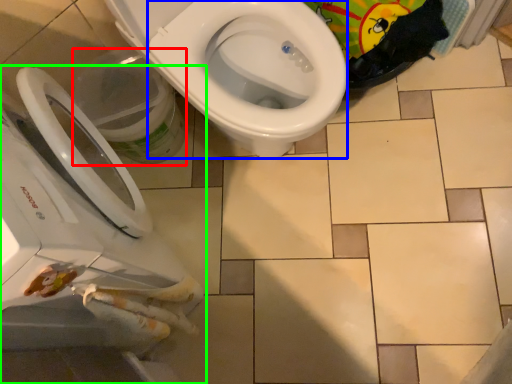
Question: Based on their relative distances, which object is nearer to potty (highlighted by a red box)? Choose from bidet (highlighted by a blue box) and toilet (highlighted by a green box).

Choices:
 (A) bidet
 (B) toilet

Answer: (A)